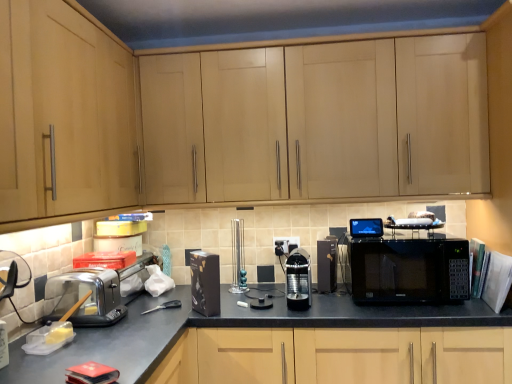
Question: Is point (281, 69) closer or farther from the camera than point (14, 130)?

Choices:
 (A) closer
 (B) farther

Answer: (B)

Question: In the image, is light wood cabinet at upper center, which appears as the 2th cabinetry when viewed from the left, positioned in front of or behind light wood cabinet at left, acting as the second cabinetry starting from the right?

Choices:
 (A) front
 (B) behind

Answer: (B)

Question: Which of these objects is positioned farthest from the clear plastic toaster at lower left?

Choices:
 (A) black plastic electric outlet at center
 (B) light wood cabinet at left, the 1th cabinetry from the left
 (C) black glossy microwave at center
 (D) black plastic coffee machine at center, which appears as the 1th appliance when viewed from the right
 (E) metallic teal candlesticks at center, arranged as the 2th appliance when viewed from the left

Answer: (C)

Question: Which is nearer to the light wood cabinet at upper center, which is counted as the 1th cabinetry, starting from the right?

Choices:
 (A) black plastic coffee machine at center, placed as the fourth appliance when sorted from left to right
 (B) black plastic electric outlet at center
 (C) clear plastic toaster at lower left
 (D) black matte countertop at center
 (E) light wood cabinet at left, which is the 1th cabinetry from front to back

Answer: (E)